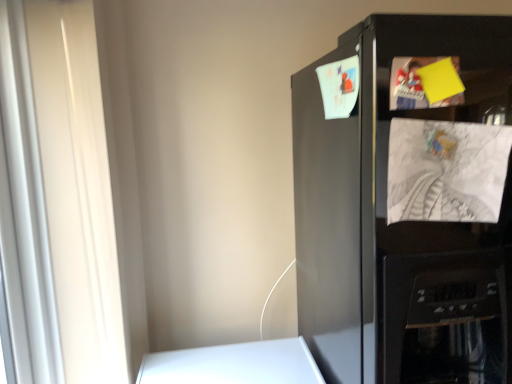
Measure the distance between point (468, 244) and camera.

The depth of point (468, 244) is 37.01 inches.

What do you see at coordinates (398, 222) in the screenshot?
I see `black matte refrigerator at upper right` at bounding box center [398, 222].

This screenshot has width=512, height=384. Identify the location of black matte refrigerator at upper right. (398, 222).

The image size is (512, 384). What do you see at coordinates (446, 171) in the screenshot? I see `white textured paper at right` at bounding box center [446, 171].

The height and width of the screenshot is (384, 512). Identify the location of white textured paper at right. (446, 171).

Where is `black matte refrigerator at upper right`? This screenshot has width=512, height=384. black matte refrigerator at upper right is located at coordinates (398, 222).

Is white textured paper at right to the right of black matte refrigerator at upper right from the viewer's perspective?

No, white textured paper at right is not to the right of black matte refrigerator at upper right.

Which is in front, white textured paper at right or black matte refrigerator at upper right?

black matte refrigerator at upper right is closer to the camera.

Is point (484, 146) closer or farther from the camera than point (476, 339)?

Clearly, point (484, 146) is closer to the camera than point (476, 339).

From the image's perspective, which object appears higher, white textured paper at right or black matte refrigerator at upper right?

From the image's view, white textured paper at right is above.

From a real-world perspective, which object stands above the other?

white textured paper at right, from a real-world perspective.

Is white textured paper at right thinner than black matte refrigerator at upper right?

Yes, white textured paper at right is thinner than black matte refrigerator at upper right.

Between white textured paper at right and black matte refrigerator at upper right, which one has less height?

Standing shorter between the two is white textured paper at right.

Which of these two, white textured paper at right or black matte refrigerator at upper right, is smaller?

white textured paper at right.

Is white textured paper at right positioned beyond the bounds of black matte refrigerator at upper right?

That's incorrect, white textured paper at right is not completely outside black matte refrigerator at upper right.

Are white textured paper at right and black matte refrigerator at upper right far apart?

white textured paper at right is near black matte refrigerator at upper right, not far away.

Is white textured paper at right oriented towards black matte refrigerator at upper right?

Yes, white textured paper at right is facing black matte refrigerator at upper right.

Measure the distance from white textured paper at right to black matte refrigerator at upper right.

white textured paper at right and black matte refrigerator at upper right are 5.15 inches apart.

Where is `refrigerator below the white textured paper at right (from a real-world perspective)`? This screenshot has width=512, height=384. refrigerator below the white textured paper at right (from a real-world perspective) is located at coordinates (398, 222).

Which object is positioned more to the left, black matte refrigerator at upper right or white textured paper at right?

Positioned to the left is white textured paper at right.

Is black matte refrigerator at upper right in front of or behind white textured paper at right in the image?

Visually, black matte refrigerator at upper right is located in front of white textured paper at right.

Is point (378, 38) closer or farther from the camera than point (394, 131)?

Point (378, 38) appears to be farther away from the viewer than point (394, 131).

From the image's perspective, between black matte refrigerator at upper right and white textured paper at right, who is located below?

black matte refrigerator at upper right.

From a real-world perspective, does black matte refrigerator at upper right stand above white textured paper at right?

No, from a real-world perspective, black matte refrigerator at upper right is not above white textured paper at right.

Between black matte refrigerator at upper right and white textured paper at right, which one has smaller width?

white textured paper at right is thinner.

Considering the relative sizes of black matte refrigerator at upper right and white textured paper at right in the image provided, is black matte refrigerator at upper right shorter than white textured paper at right?

No, black matte refrigerator at upper right is not shorter than white textured paper at right.

Considering the sizes of objects black matte refrigerator at upper right and white textured paper at right in the image provided, who is bigger, black matte refrigerator at upper right or white textured paper at right?

black matte refrigerator at upper right is bigger.

Does black matte refrigerator at upper right contain white textured paper at right?

Yes, white textured paper at right can be found within black matte refrigerator at upper right.

Consider the image. Are black matte refrigerator at upper right and white textured paper at right beside each other?

No.

Based on the photo, is black matte refrigerator at upper right looking in the opposite direction of white textured paper at right?

black matte refrigerator at upper right does not have its back to white textured paper at right.

You are a GUI agent. You are given a task and a screenshot of the screen. Output one action in this format:
    pyautogui.click(x=<x>, y=<y>)
    Task: Click on the paper that is on the left side of black matte refrigerator at upper right
    
    Given the screenshot: What is the action you would take?
    pyautogui.click(x=446, y=171)

Where is `paper above the black matte refrigerator at upper right (from the image's perspective)`? This screenshot has height=384, width=512. paper above the black matte refrigerator at upper right (from the image's perspective) is located at coordinates (446, 171).

Locate an element on the screen. The image size is (512, 384). refrigerator in front of the white textured paper at right is located at coordinates 398,222.